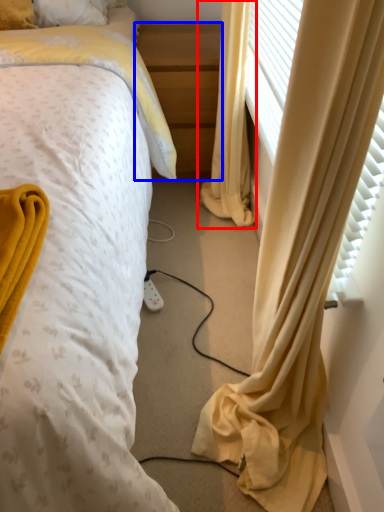
Question: Which object appears farthest to the camera in this image, curtain (highlighted by a red box) or nightstand (highlighted by a blue box)?

Choices:
 (A) curtain
 (B) nightstand

Answer: (B)